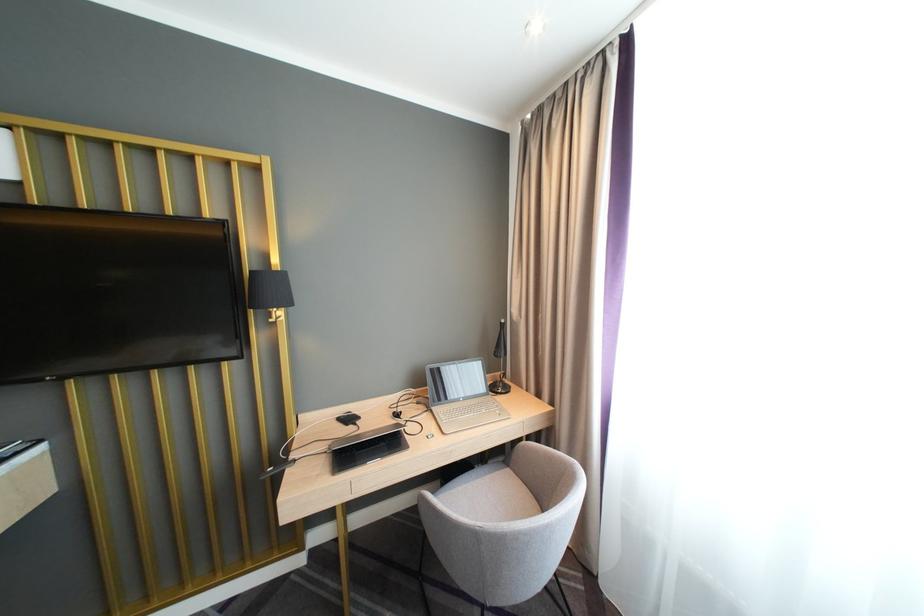
Which object does [369,442] point to?

This point indicates the black tablet computer.